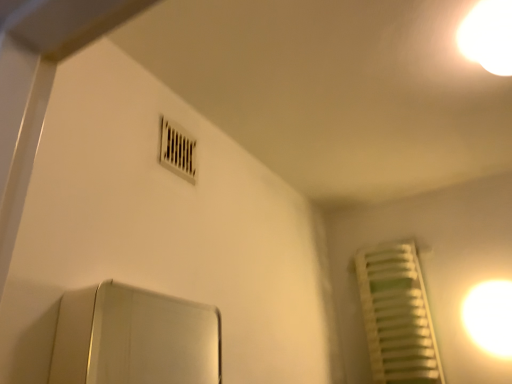
Question: Does white matte radiator at right have a lesser height compared to white glossy light bulb at upper right, acting as the 2th light starting from the back?

Choices:
 (A) yes
 (B) no

Answer: (B)

Question: Is white glossy light bulb at upper right, the 2th light from the right, at the back of white matte radiator at right?

Choices:
 (A) yes
 (B) no

Answer: (B)

Question: From the image's perspective, is white matte radiator at right beneath white glossy light bulb at upper right, the 2th light from the right?

Choices:
 (A) no
 (B) yes

Answer: (B)

Question: Is white matte radiator at right not within white glossy light bulb at upper right, which is the second light from bottom to top?

Choices:
 (A) yes
 (B) no

Answer: (A)

Question: Does white matte radiator at right have a greater height compared to white glossy light bulb at upper right, arranged as the first light when viewed from the front?

Choices:
 (A) yes
 (B) no

Answer: (A)

Question: Are white matte radiator at right and white glossy light bulb at upper right, the 2th light from the right, beside each other?

Choices:
 (A) no
 (B) yes

Answer: (A)

Question: Does white plastic air conditioning at upper center have a greater height compared to white glossy light at upper right, the second light from the front?

Choices:
 (A) no
 (B) yes

Answer: (B)

Question: From the image's perspective, is white plastic air conditioning at upper center on white glossy light at upper right, the second light from the front?

Choices:
 (A) no
 (B) yes

Answer: (B)

Question: Is white plastic air conditioning at upper center thinner than white glossy light at upper right, acting as the 2th light starting from the left?

Choices:
 (A) yes
 (B) no

Answer: (A)

Question: Is white plastic air conditioning at upper center far away from white glossy light at upper right, acting as the 2th light starting from the left?

Choices:
 (A) no
 (B) yes

Answer: (B)

Question: From a real-world perspective, is white plastic air conditioning at upper center positioned over white glossy light at upper right, acting as the 2th light starting from the left, based on gravity?

Choices:
 (A) yes
 (B) no

Answer: (A)

Question: Considering the relative sizes of white plastic air conditioning at upper center and white glossy light at upper right, the first light when ordered from right to left, in the image provided, is white plastic air conditioning at upper center bigger than white glossy light at upper right, the first light when ordered from right to left,?

Choices:
 (A) no
 (B) yes

Answer: (A)

Question: Can you confirm if white plastic air conditioning at upper center is shorter than white matte radiator at right?

Choices:
 (A) no
 (B) yes

Answer: (B)